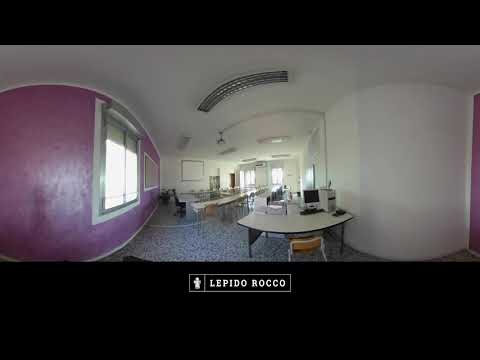
Where is `window shade`? Image resolution: width=480 pixels, height=360 pixels. window shade is located at coordinates (151, 171), (115, 140), (130, 143).